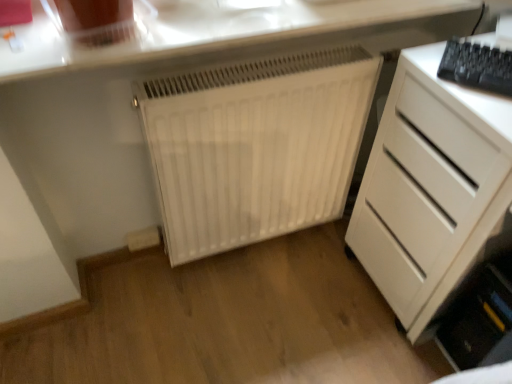
Question: Considering the relative sizes of white matte radiator at center and white matte chest of drawers at right in the image provided, is white matte radiator at center taller than white matte chest of drawers at right?

Choices:
 (A) yes
 (B) no

Answer: (B)

Question: Is white matte radiator at center facing away from white matte chest of drawers at right?

Choices:
 (A) yes
 (B) no

Answer: (B)

Question: Can you confirm if white matte radiator at center is shorter than white matte chest of drawers at right?

Choices:
 (A) no
 (B) yes

Answer: (B)

Question: Is white matte radiator at center bigger than white matte chest of drawers at right?

Choices:
 (A) no
 (B) yes

Answer: (A)

Question: Would you say white matte radiator at center is outside white matte chest of drawers at right?

Choices:
 (A) yes
 (B) no

Answer: (A)

Question: Considering the positions of white matte radiator at center and white matte chest of drawers at right in the image, is white matte radiator at center bigger or smaller than white matte chest of drawers at right?

Choices:
 (A) big
 (B) small

Answer: (B)

Question: Which is correct: white matte radiator at center is inside white matte chest of drawers at right, or outside of it?

Choices:
 (A) outside
 (B) inside

Answer: (A)

Question: Is point (290, 99) closer or farther from the camera than point (350, 218)?

Choices:
 (A) farther
 (B) closer

Answer: (B)

Question: In the image, is white matte radiator at center on the left side or the right side of white matte chest of drawers at right?

Choices:
 (A) right
 (B) left

Answer: (B)

Question: From the image's perspective, relative to white matte radiator at center, is black plastic keyboard at upper right above or below?

Choices:
 (A) above
 (B) below

Answer: (A)

Question: Does point (504, 56) appear closer or farther from the camera than point (237, 206)?

Choices:
 (A) closer
 (B) farther

Answer: (A)

Question: Is black plastic keyboard at upper right wider or thinner than white matte radiator at center?

Choices:
 (A) thin
 (B) wide

Answer: (B)

Question: In terms of size, does black plastic keyboard at upper right appear bigger or smaller than white matte radiator at center?

Choices:
 (A) big
 (B) small

Answer: (B)

Question: Which is correct: white matte radiator at center is inside white glossy countertop at upper center, or outside of it?

Choices:
 (A) outside
 (B) inside

Answer: (A)

Question: Does point (183, 137) appear closer or farther from the camera than point (158, 41)?

Choices:
 (A) closer
 (B) farther

Answer: (B)